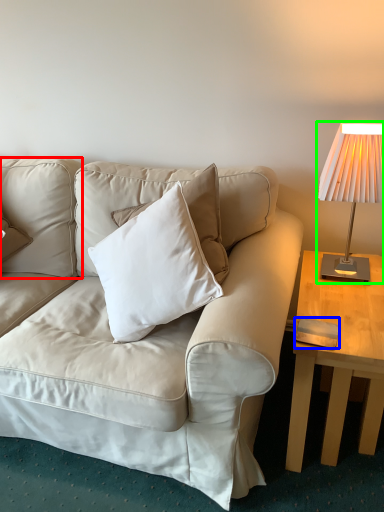
Question: Estimate the real-world distances between objects in this image. Which object is farther from pillow (highlighted by a red box), pad (highlighted by a blue box) or lamp (highlighted by a green box)?

Choices:
 (A) pad
 (B) lamp

Answer: (A)